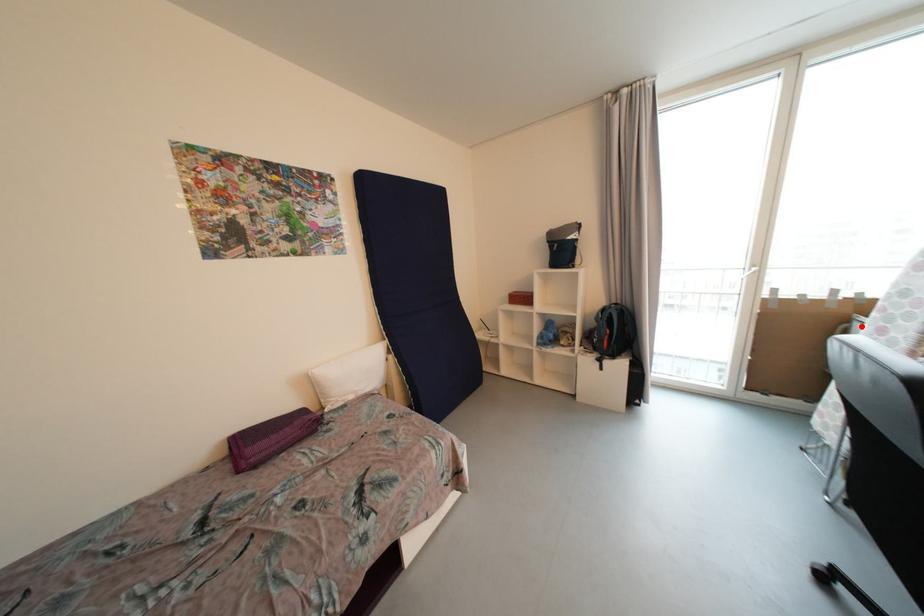
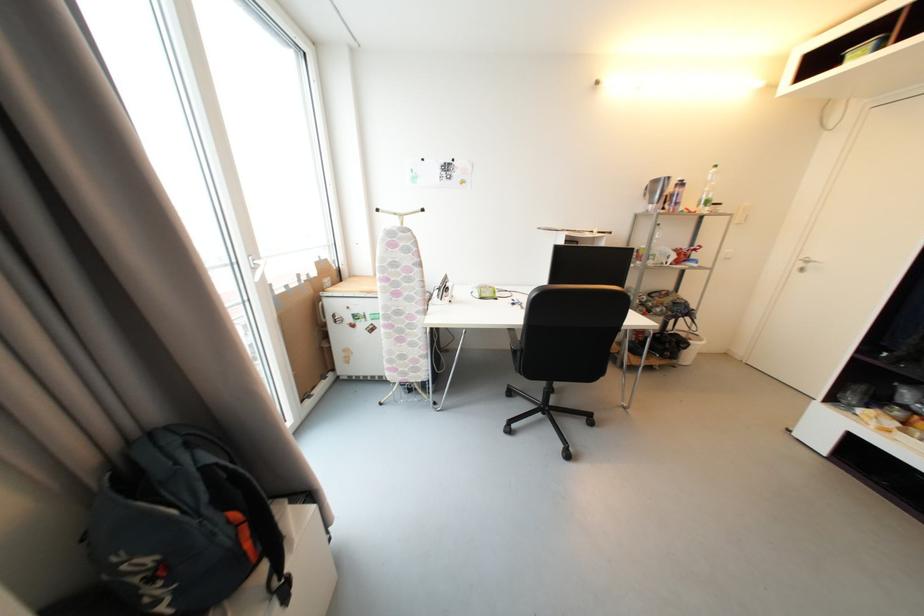
Where in the second image is the point corresponding to the highlighted location from the first image?

(330, 302)